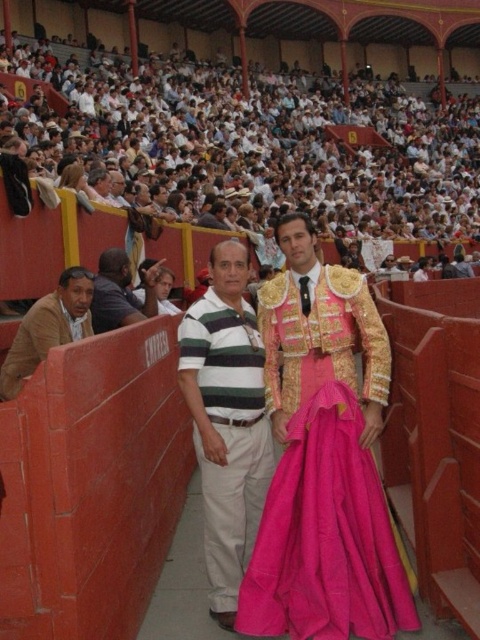
Is brown leather jacket at left taller than dark blue shirt at left?

Indeed, brown leather jacket at left has a greater height compared to dark blue shirt at left.

Which is more to the left, brown leather jacket at left or dark blue shirt at left?

brown leather jacket at left

Which is behind, point (49, 305) or point (104, 252)?

The point (104, 252) is more distant.

Identify the location of brown leather jacket at left. (48, 326).

Can you confirm if green striped shirt at center is taller than brown leather jacket at left?

Indeed, green striped shirt at center has a greater height compared to brown leather jacket at left.

The image size is (480, 640). I want to click on green striped shirt at center, so click(227, 420).

Locate an element on the screen. The image size is (480, 640). green striped shirt at center is located at coordinates (227, 420).

Find the location of a particular element. pink satin dress at center is located at coordinates (325, 536).

Does pink satin dress at center appear under green striped shirt at center?

Yes, pink satin dress at center is below green striped shirt at center.

The width and height of the screenshot is (480, 640). I want to click on pink satin dress at center, so click(x=325, y=536).